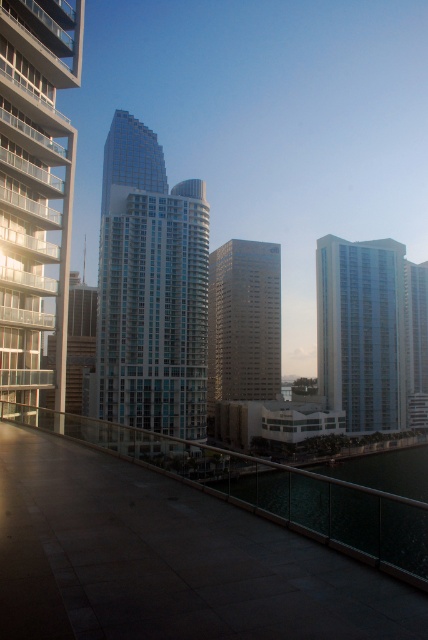
Which is behind, point (160, 157) or point (395, 401)?

The point (160, 157) is behind.

From the picture: How far apart are glassy steel skyscraper at center and matte glass building at right?

glassy steel skyscraper at center is 199.07 feet away from matte glass building at right.

In order to click on glassy steel skyscraper at center in this screenshot , I will do click(151, 289).

Find the location of a particular element. This screenshot has width=428, height=640. glassy steel skyscraper at center is located at coordinates (151, 289).

Which is behind, point (294, 518) or point (335, 356)?

Positioned behind is point (335, 356).

Can you confirm if metallic glass railing at center is positioned to the left of matte glass building at right?

Indeed, metallic glass railing at center is positioned on the left side of matte glass building at right.

Measure the distance between point (303, 472) and camera.

Point (303, 472) and camera are 28.36 feet apart.

The height and width of the screenshot is (640, 428). In order to click on metallic glass railing at center in this screenshot , I will do `click(265, 490)`.

Between point (38, 253) and point (362, 396), which one is positioned behind?

The point (362, 396) is behind.

Who is positioned more to the left, glassy steel building at left or matte glass building at right?

From the viewer's perspective, glassy steel building at left appears more on the left side.

This screenshot has width=428, height=640. What are the coordinates of `glassy steel building at left` in the screenshot? It's located at click(x=35, y=189).

Find the location of a particular element. The image size is (428, 640). glassy steel building at left is located at coordinates (35, 189).